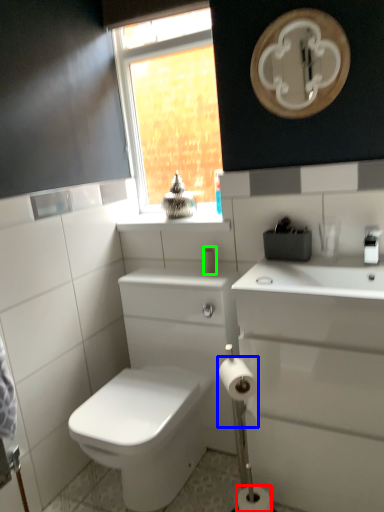
Question: Based on their relative distances, which object is nearer to toilet paper (highlighted by a red box)? Choose from toilet paper (highlighted by a blue box) and toiletry (highlighted by a green box).

Choices:
 (A) toilet paper
 (B) toiletry

Answer: (A)